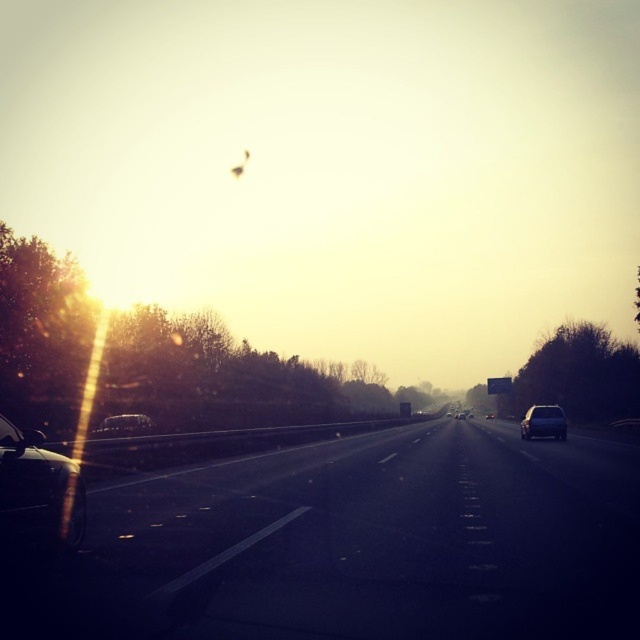
Question: Can you confirm if black asphalt highway at center is bigger than satin silver sedan at center?

Choices:
 (A) no
 (B) yes

Answer: (A)

Question: Which of the following is the closest to the observer?

Choices:
 (A) shiny metallic car at left
 (B) black asphalt highway at center

Answer: (B)

Question: Can you confirm if shiny metallic car at left is wider than satin silver sedan at center?

Choices:
 (A) yes
 (B) no

Answer: (B)

Question: Does black asphalt highway at center appear over shiny metallic car at left?

Choices:
 (A) yes
 (B) no

Answer: (B)

Question: Among these objects, which one is farthest from the camera?

Choices:
 (A) satin black sedan at right
 (B) black asphalt highway at center
 (C) satin black car at left

Answer: (A)

Question: Among these points, which one is nearest to the camera?

Choices:
 (A) click(x=493, y=637)
 (B) click(x=461, y=419)
 (C) click(x=26, y=433)
 (D) click(x=556, y=432)

Answer: (A)